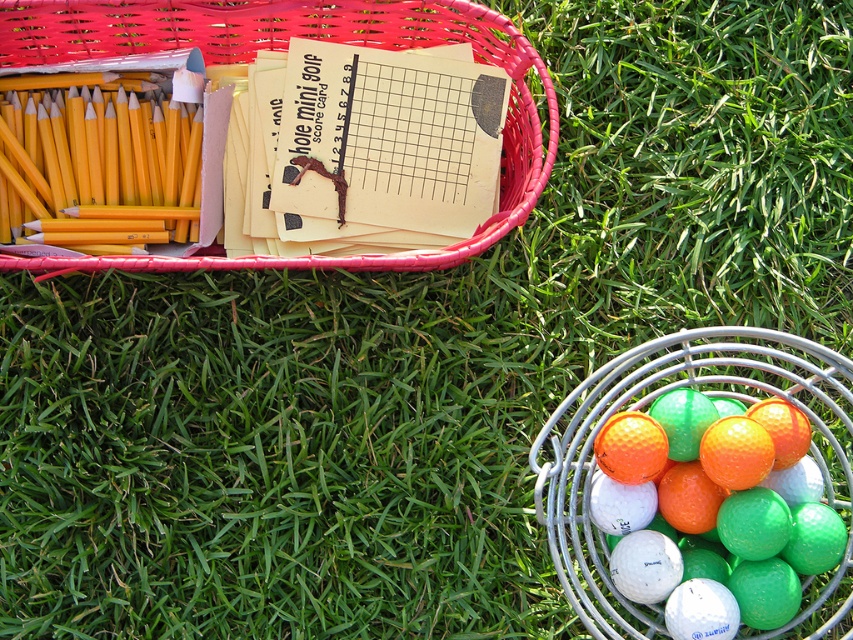
Question: Among these points, which one is farthest from the camera?

Choices:
 (A) (726, 636)
 (B) (630, 355)

Answer: (B)

Question: Where is matte plastic basket at upper left located in relation to white matte golf ball at lower right in the image?

Choices:
 (A) above
 (B) below

Answer: (A)

Question: Is matte plastic basket at upper left positioned in front of white matte golf ball at lower right?

Choices:
 (A) yes
 (B) no

Answer: (B)

Question: Which point appears farthest from the camera in this image?

Choices:
 (A) (x=374, y=28)
 (B) (x=724, y=589)

Answer: (A)

Question: Based on their relative distances, which object is farther from the matte plastic basket at upper left?

Choices:
 (A) white matte golf ball at lower right
 (B) rubberized plastic golf balls at right

Answer: (A)

Question: In this image, where is rubberized plastic golf balls at right located relative to white matte golf ball at lower right?

Choices:
 (A) right
 (B) left

Answer: (A)